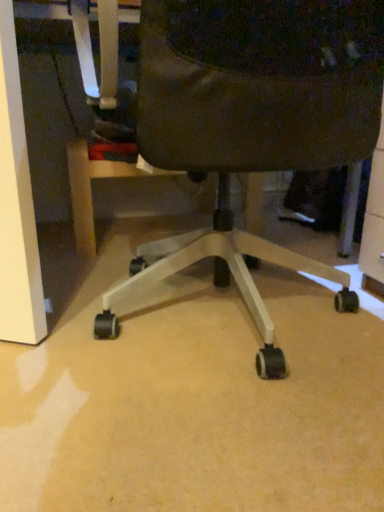
Image resolution: width=384 pixels, height=512 pixels. Describe the element at coordinates (252, 121) in the screenshot. I see `black leather chair at center` at that location.

Find the location of a particular element. This screenshot has height=512, width=384. black leather chair at center is located at coordinates (252, 121).

Find the location of a particular element. black leather chair at center is located at coordinates (252, 121).